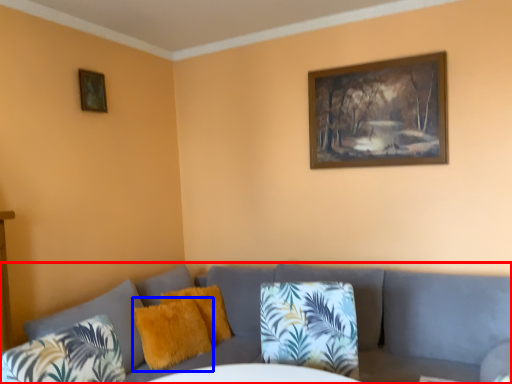
Question: Which of the following is the farthest to the observer, studio couch (highlighted by a red box) or pillow (highlighted by a blue box)?

Choices:
 (A) studio couch
 (B) pillow

Answer: (B)